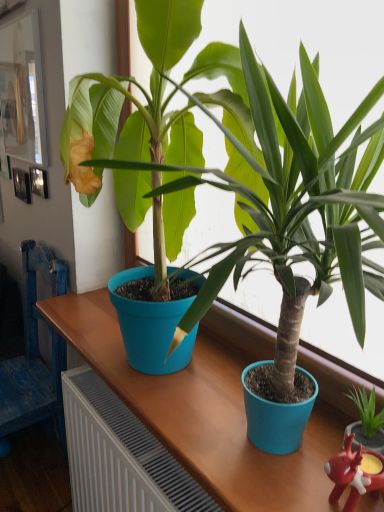
Question: Would you consider blue fabric chair at left to be distant from rubberized red reindeer at lower right?

Choices:
 (A) no
 (B) yes

Answer: (B)

Question: Is blue fabric chair at left positioned in front of rubberized red reindeer at lower right?

Choices:
 (A) yes
 (B) no

Answer: (B)

Question: Can you confirm if blue fabric chair at left is positioned to the left of rubberized red reindeer at lower right?

Choices:
 (A) yes
 (B) no

Answer: (A)

Question: Can you confirm if blue fabric chair at left is taller than rubberized red reindeer at lower right?

Choices:
 (A) yes
 (B) no

Answer: (A)

Question: Considering the relative positions of blue fabric chair at left and rubberized red reindeer at lower right in the image provided, is blue fabric chair at left to the right of rubberized red reindeer at lower right from the viewer's perspective?

Choices:
 (A) yes
 (B) no

Answer: (B)

Question: From the image's perspective, is blue fabric chair at left over rubberized red reindeer at lower right?

Choices:
 (A) no
 (B) yes

Answer: (A)

Question: Is rubberized red reindeer at lower right shorter than white glossy picture frame at upper left?

Choices:
 (A) no
 (B) yes

Answer: (B)

Question: Is rubberized red reindeer at lower right smaller than white glossy picture frame at upper left?

Choices:
 (A) yes
 (B) no

Answer: (A)

Question: Considering the relative sizes of rubberized red reindeer at lower right and white glossy picture frame at upper left in the image provided, is rubberized red reindeer at lower right bigger than white glossy picture frame at upper left?

Choices:
 (A) no
 (B) yes

Answer: (A)

Question: Does rubberized red reindeer at lower right have a greater height compared to white glossy picture frame at upper left?

Choices:
 (A) yes
 (B) no

Answer: (B)

Question: Does rubberized red reindeer at lower right appear on the right side of white glossy picture frame at upper left?

Choices:
 (A) yes
 (B) no

Answer: (A)

Question: Is rubberized red reindeer at lower right oriented away from white glossy picture frame at upper left?

Choices:
 (A) yes
 (B) no

Answer: (B)

Question: Does blue fabric chair at left have a greater height compared to white glossy picture frame at upper left?

Choices:
 (A) no
 (B) yes

Answer: (B)